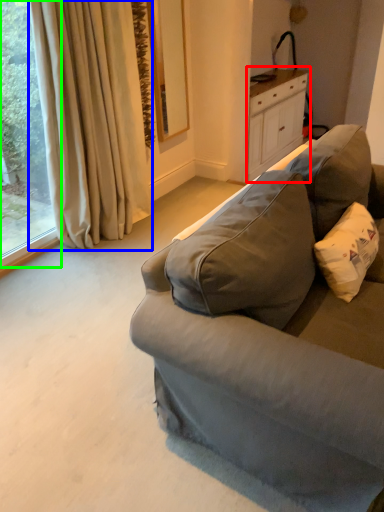
Question: Based on their relative distances, which object is farther from cabinetry (highlighted by a red box)? Choose from curtain (highlighted by a blue box) and window (highlighted by a green box).

Choices:
 (A) curtain
 (B) window

Answer: (B)